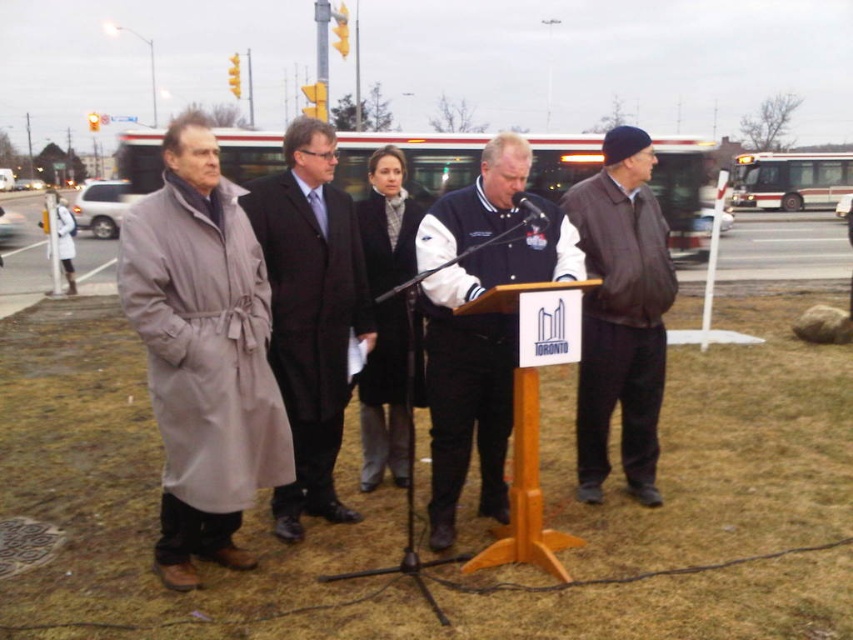
You are a photographer at the event and want to take a photo of both the light beige trench coat at left and the brown leather jacket at right. Which person should you focus on first if you want to capture both in the frame?

The light beige trench coat at left is positioned over brown leather jacket at right, so you should focus on the light beige trench coat at left first to ensure both are in the frame.

You are attending an outdoor event and see two people wearing coats. The first person is wearing a light beige trench coat at left, and the second person is wearing a brown leather jacket at right. From your perspective, which coat is positioned more to the left?

The light beige trench coat at left is positioned more to the left than the brown leather jacket at right.